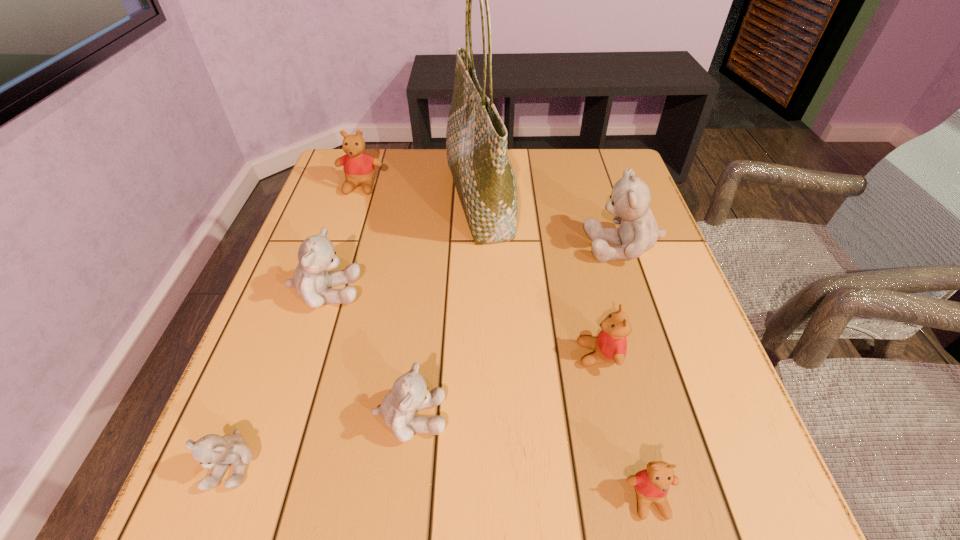
Where is `the tallest object`? The image size is (960, 540). the tallest object is located at coordinates (476, 138).

This screenshot has width=960, height=540. Identify the location of shopping bag. (476, 138).

The height and width of the screenshot is (540, 960). I want to click on the farthest gray teddy bear, so click(629, 202).

Image resolution: width=960 pixels, height=540 pixels. In order to click on the seventh shortest object in this screenshot , I will do click(629, 202).

In order to click on the farthest red teddy bear in this screenshot , I will do `click(358, 166)`.

Identify the location of the leftmost red teddy bear. Image resolution: width=960 pixels, height=540 pixels. (358, 166).

Where is `the third smallest gray teddy bear`? the third smallest gray teddy bear is located at coordinates (316, 255).

Identify the location of the second farthest gray teddy bear. (316, 255).

The width and height of the screenshot is (960, 540). I want to click on the second smallest red teddy bear, so click(610, 346).

This screenshot has width=960, height=540. I want to click on the second farthest red teddy bear, so click(x=610, y=346).